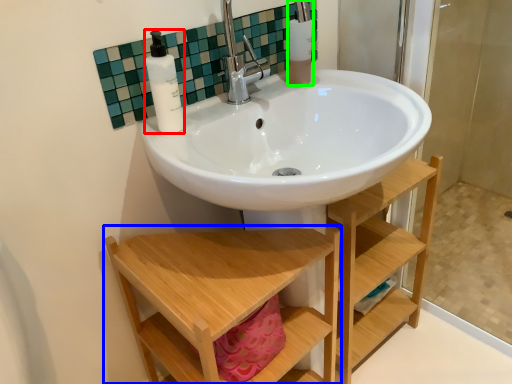
Question: Which is nearer to the soap dispenser (highlighted by a red box)? furniture (highlighted by a blue box) or toiletry (highlighted by a green box).

Choices:
 (A) furniture
 (B) toiletry

Answer: (B)